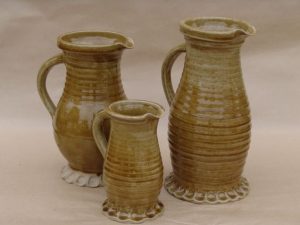
Locate an element on the screen. This screenshot has height=225, width=300. small pitcher body is located at coordinates (135, 162).